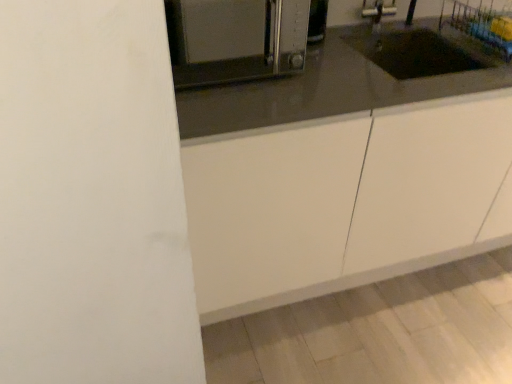
Question: Considering the positions of white matte cabinet at center and satin silver toaster at upper center in the image, is white matte cabinet at center bigger or smaller than satin silver toaster at upper center?

Choices:
 (A) big
 (B) small

Answer: (A)

Question: Is white matte cabinet at center inside or outside of satin silver toaster at upper center?

Choices:
 (A) inside
 (B) outside

Answer: (B)

Question: In terms of width, does white matte cabinet at center look wider or thinner when compared to satin silver toaster at upper center?

Choices:
 (A) thin
 (B) wide

Answer: (B)

Question: Considering their positions, is satin silver toaster at upper center located in front of or behind white matte cabinet at center?

Choices:
 (A) behind
 (B) front

Answer: (B)

Question: Is satin silver toaster at upper center to the left or to the right of white matte cabinet at center in the image?

Choices:
 (A) right
 (B) left

Answer: (B)

Question: Looking at the image, does satin silver toaster at upper center seem bigger or smaller compared to white matte cabinet at center?

Choices:
 (A) big
 (B) small

Answer: (B)

Question: From the image's perspective, is satin silver toaster at upper center above or below white matte cabinet at center?

Choices:
 (A) above
 (B) below

Answer: (A)